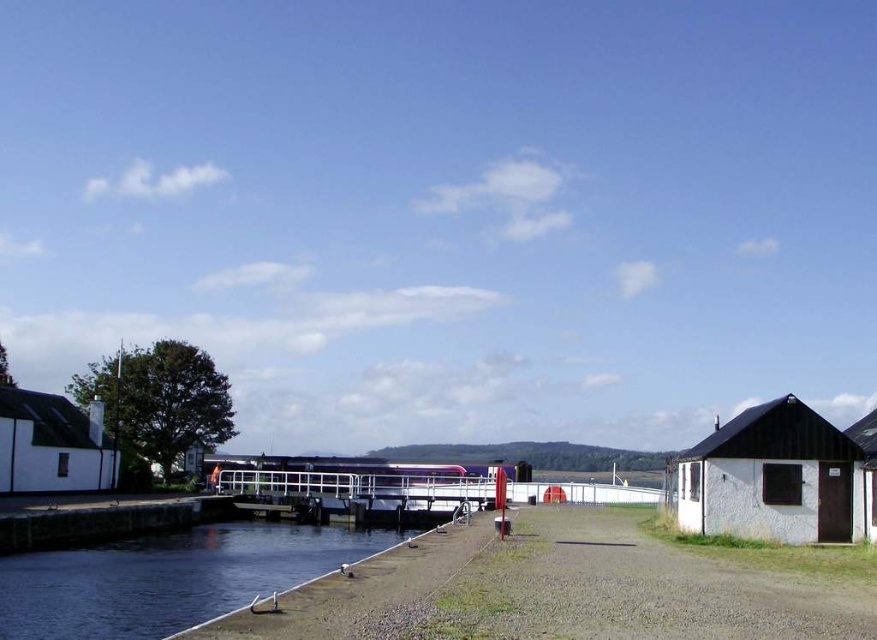
You are standing at the riverside and want to walk from the smooth concrete river at lower left to the white matte hut at right. Which direction should you head?

You should head to the right because the smooth concrete river at lower left is to the left of the white matte hut at right.

You are standing on the gravel path near the water and want to go to the white stone hut at lower right and the white matte hut at right. Which one is higher up the slope?

The white stone hut at lower right is located above the white matte hut at right, so it is higher up the slope.